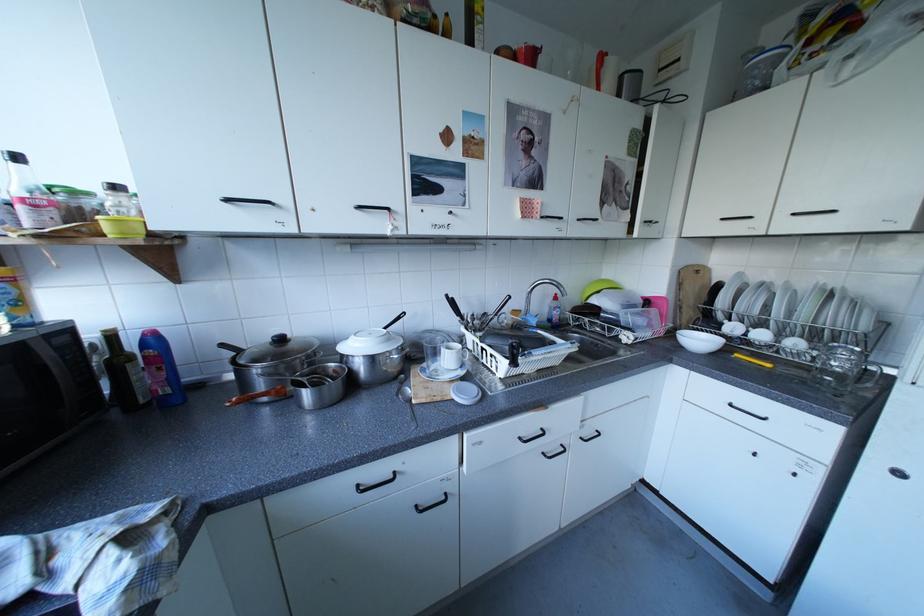
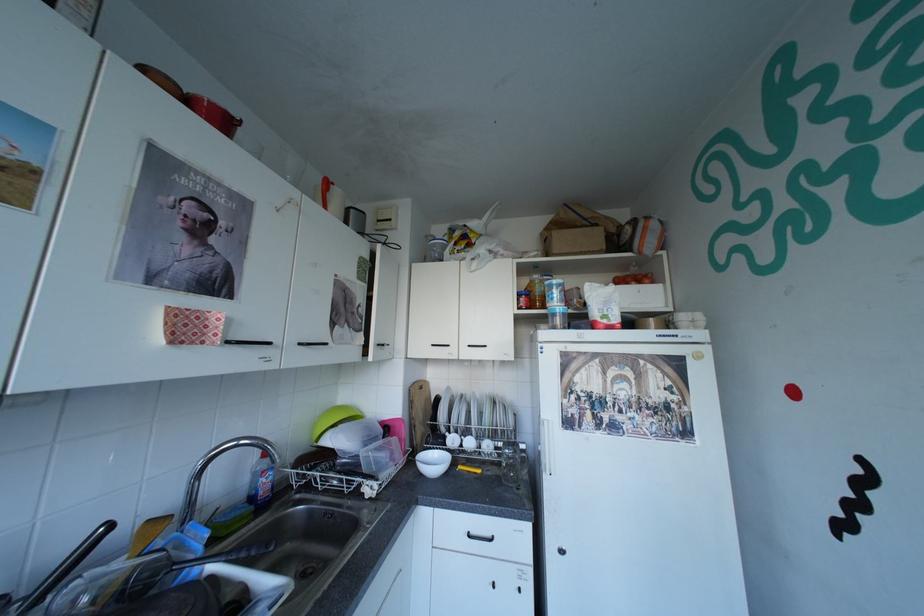
Based on the continuous images, in which direction is the camera rotating?

The camera's rotation is toward right-up.